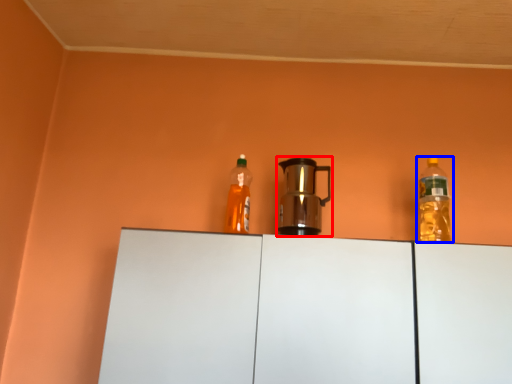
Question: Which of the following is the farthest to the observer, kitchen appliance (highlighted by a red box) or bottle (highlighted by a blue box)?

Choices:
 (A) kitchen appliance
 (B) bottle

Answer: (B)